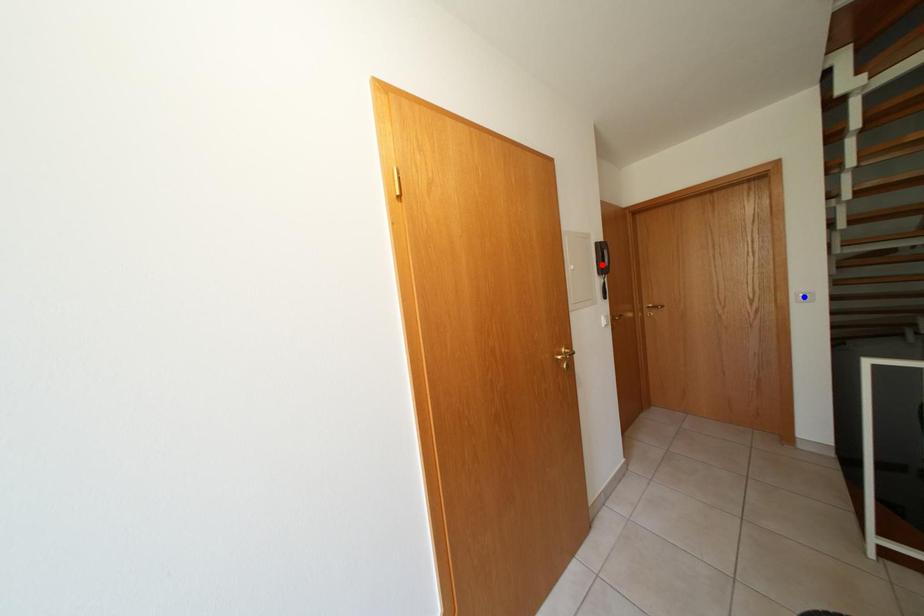
Question: Which of the two points in the image is closer to the camera?

Choices:
 (A) Blue point is closer.
 (B) Red point is closer.

Answer: (B)